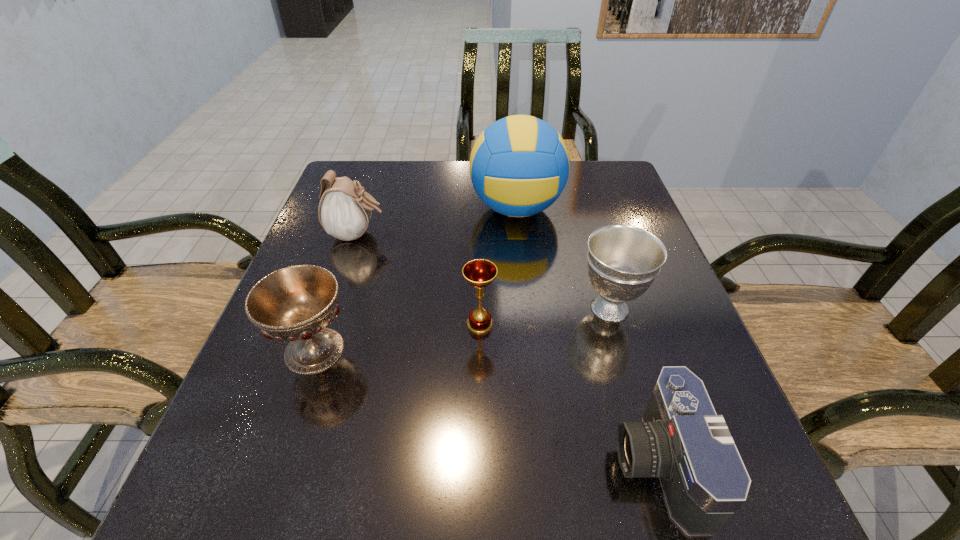
What are the coordinates of `vacant point located between the pouch and the tallest object` in the screenshot? It's located at (437, 221).

The image size is (960, 540). In order to click on unoccupied position between the tallest object and the shortest object in this screenshot , I will do `click(587, 336)`.

At what (x,y) coordinates should I click in order to perform the action: click on free area in between the nearest object and the rightmost chalice. Please return your answer as a coordinate pair (x, y). Looking at the image, I should click on (634, 386).

In order to click on free space between the pouch and the nearest object in this screenshot , I will do `click(508, 348)`.

Where is `free space between the second chalice from right to left and the shortest object`? Image resolution: width=960 pixels, height=540 pixels. free space between the second chalice from right to left and the shortest object is located at coordinates (568, 394).

Locate an element on the screen. The image size is (960, 540). free space that is in between the rightmost chalice and the volleyball is located at coordinates (564, 259).

Where is `the fourth closest object to the tallest object`? the fourth closest object to the tallest object is located at coordinates (296, 303).

Where is `object that is the third closest to the pouch`? object that is the third closest to the pouch is located at coordinates (479, 273).

I want to click on chalice that is the closest one to the second chalice from right to left, so click(623, 261).

Where is `chalice identified as the second closest to the shortest object`? This screenshot has height=540, width=960. chalice identified as the second closest to the shortest object is located at coordinates (479, 273).